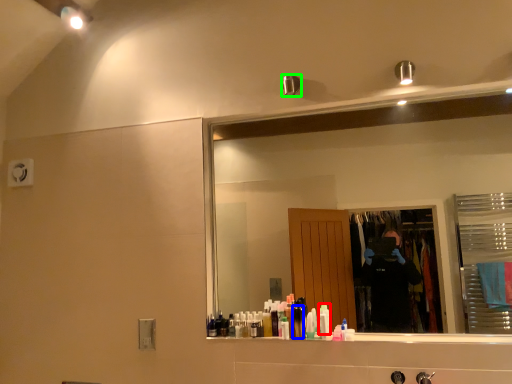
Question: Which is farther away from toiletry (highlighted by a red box)? toiletry (highlighted by a blue box) or shower (highlighted by a green box)?

Choices:
 (A) toiletry
 (B) shower

Answer: (B)